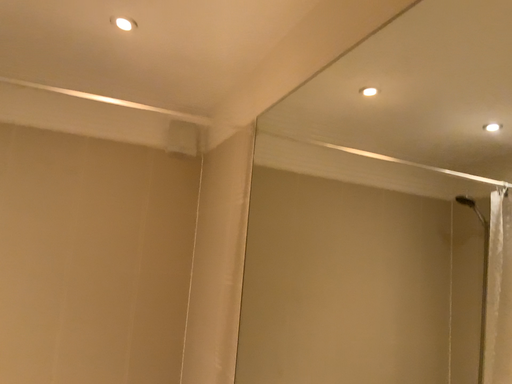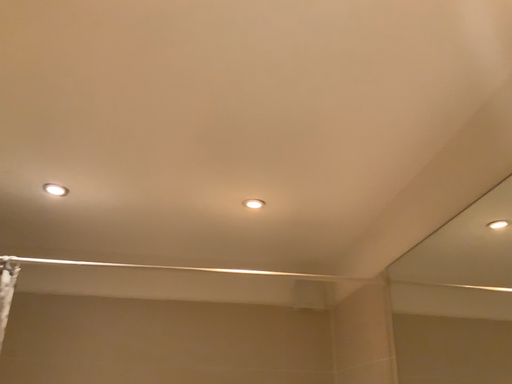
Question: How did the camera likely rotate when shooting the video?

Choices:
 (A) rotated upward
 (B) rotated downward

Answer: (A)